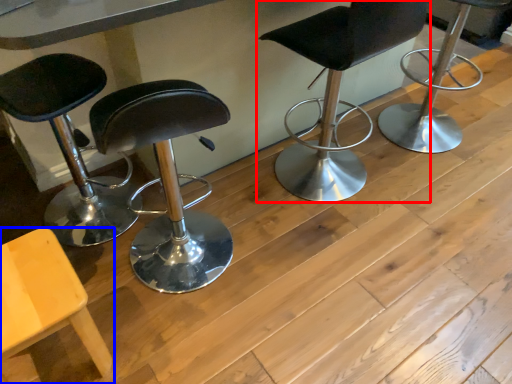
Question: Which object appears farthest to the camera in this image, chair (highlighted by a red box) or chair (highlighted by a blue box)?

Choices:
 (A) chair
 (B) chair

Answer: (A)